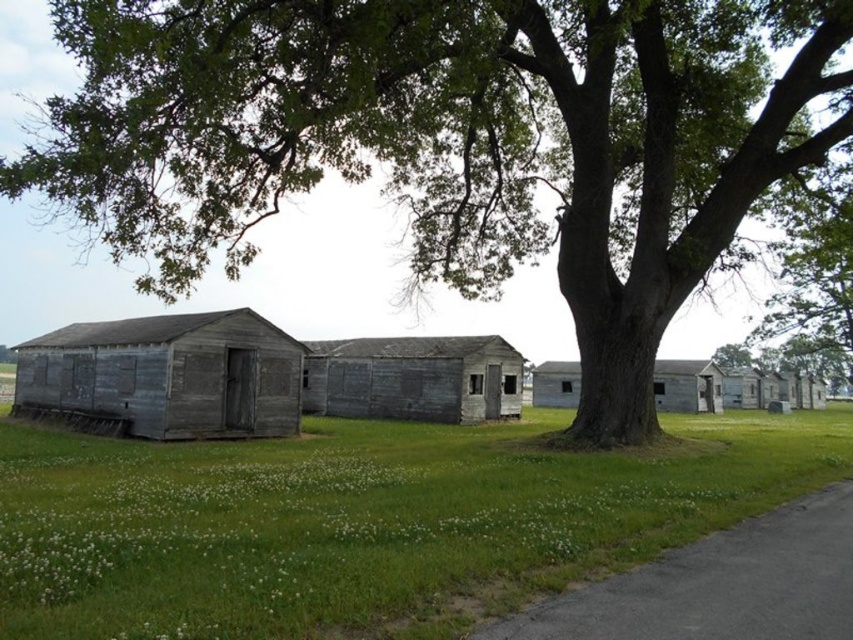
Does green grass at lower left appear under wooden hut at center?

No.

Who is positioned more to the left, green grass at lower left or wooden hut at center?

From the viewer's perspective, green grass at lower left appears more on the left side.

Between point (585, 481) and point (556, 387), which one is positioned in front?

Point (585, 481)

At what (x,y) coordinates should I click in order to perform the action: click on green grass at lower left. Please return your answer as a coordinate pair (x, y). This screenshot has width=853, height=640. Looking at the image, I should click on (363, 522).

Does green leafy tree at center appear on the left side of weathered wood hut at center?

Yes, green leafy tree at center is to the left of weathered wood hut at center.

Does point (216, 244) come in front of point (451, 365)?

That is True.

The image size is (853, 640). Describe the element at coordinates (451, 141) in the screenshot. I see `green leafy tree at center` at that location.

This screenshot has width=853, height=640. Find the location of `green leafy tree at center`. green leafy tree at center is located at coordinates (451, 141).

Who is lower down, weathered wood hut at left or weathered wood hut at center?

weathered wood hut at center

Between weathered wood hut at left and weathered wood hut at center, which one appears on the right side from the viewer's perspective?

weathered wood hut at center

Between point (119, 326) and point (393, 392), which one is positioned in front?

Point (119, 326) is more forward.

In order to click on weathered wood hut at left in this screenshot , I will do `click(169, 374)`.